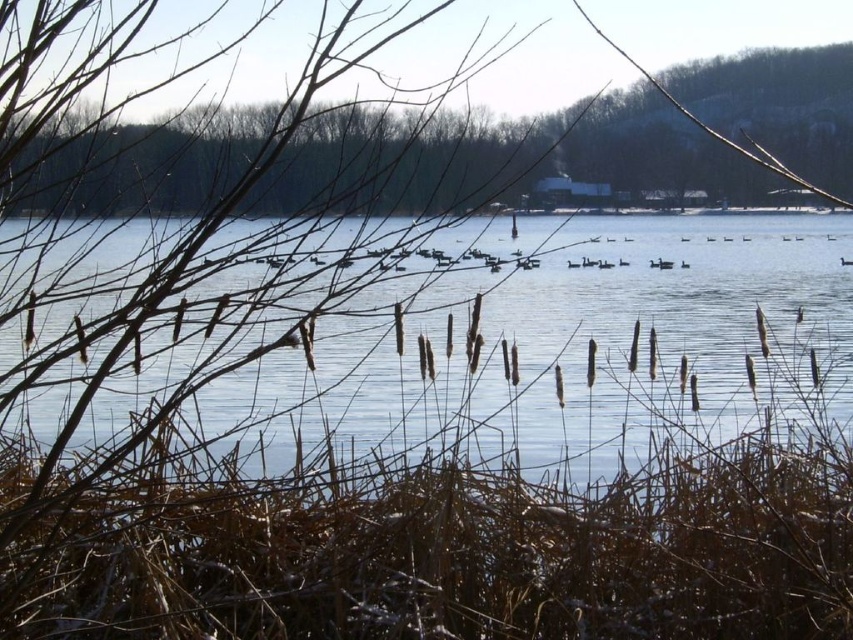
You are a photographer standing at the lakeside wanting to capture a closeup shot of both the brown reeds at center and the brown textured cattails at center. Given that your camera lens has a maximum focus range of 70 centimeters, will you be able to include both in the same frame without moving the camera?

The brown reeds at center is 74.80 centimeters from brown textured cattails at center. Since the distance between them exceeds the camera lens maximum focus range of 70 centimeters, you will not be able to include both in the same frame without moving the camera.

You are an ornithologist observing the birds on the lake. You notice that the flock is moving towards the brown reeds at center and the brown textured cattails at center. Which of these two plants will the birds reach first if they continue in their current direction?

The birds will reach the brown reeds at center first because they are positioned to the left of the brown textured cattails at center, so they are closer to the flock as it moves towards them.